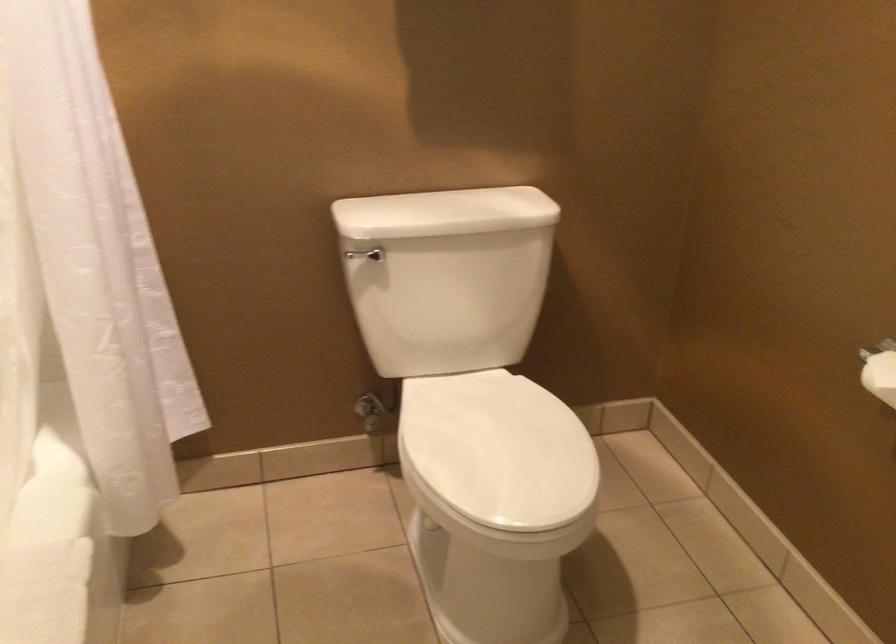
Where would you push the toilet flush handle? Please return your answer as a coordinate pair (x, y).

(365, 254)